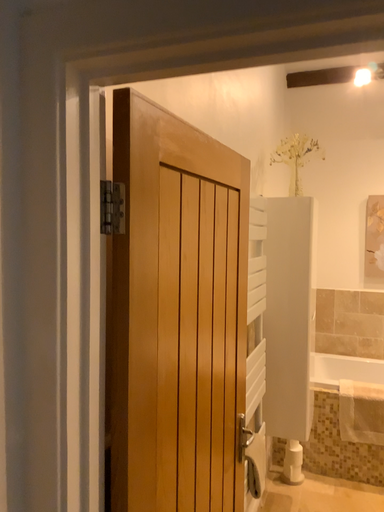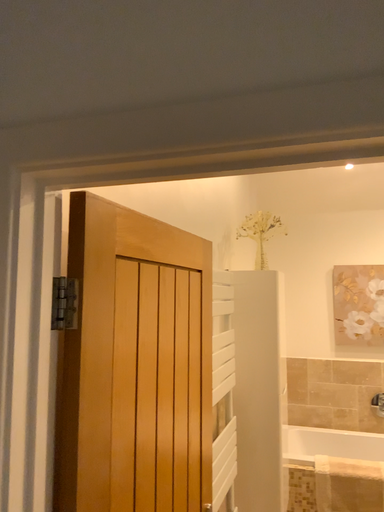
Question: How did the camera likely rotate when shooting the video?

Choices:
 (A) rotated upward
 (B) rotated downward

Answer: (A)